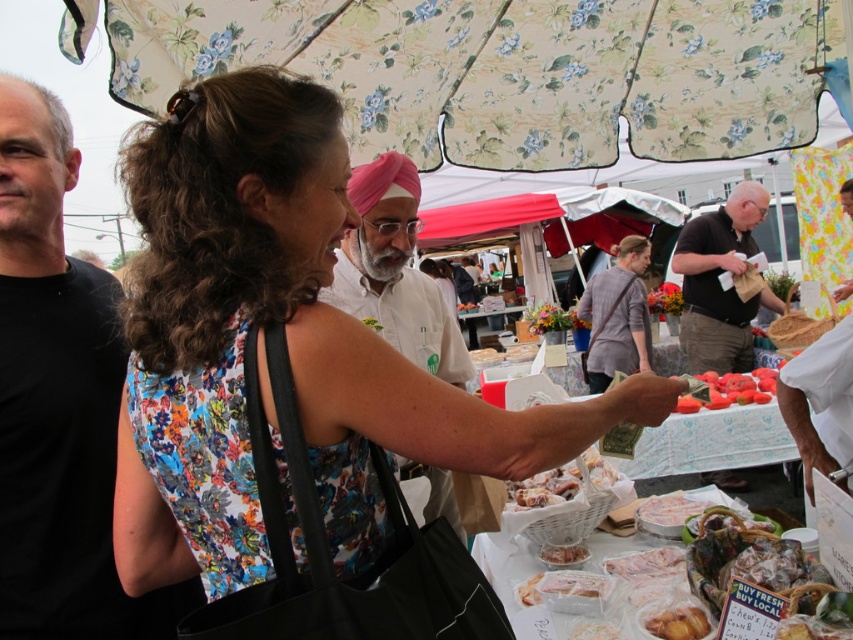
Image resolution: width=853 pixels, height=640 pixels. Describe the element at coordinates (395, 272) in the screenshot. I see `pink fabric turban at center` at that location.

Can you confirm if pink fabric turban at center is wider than white frosted pastries at center?

Yes, pink fabric turban at center is wider than white frosted pastries at center.

The height and width of the screenshot is (640, 853). I want to click on pink fabric turban at center, so click(395, 272).

At what (x,y) coordinates should I click in order to perform the action: click on dark brown leather wallet at center. Please return your answer as a coordinate pair (x, y). Looking at the image, I should click on (718, 284).

Is dark brown leather wallet at center bigger than white frosted cake at center?

Yes, dark brown leather wallet at center is bigger than white frosted cake at center.

Find the location of a particular element. dark brown leather wallet at center is located at coordinates (718, 284).

At what (x,y) coordinates should I click in order to perform the action: click on dark brown leather wallet at center. Please return your answer as a coordinate pair (x, y). This screenshot has width=853, height=640. Looking at the image, I should click on (718, 284).

Is black matte t-shirt at left above ripe red tomatoes at center?

Yes.

Is point (103, 548) positioned before point (772, 378)?

Yes.

Between point (62, 275) and point (718, 404), which one is positioned in front?

Positioned in front is point (62, 275).

Identify the location of black matte t-shirt at left. This screenshot has width=853, height=640. (51, 392).